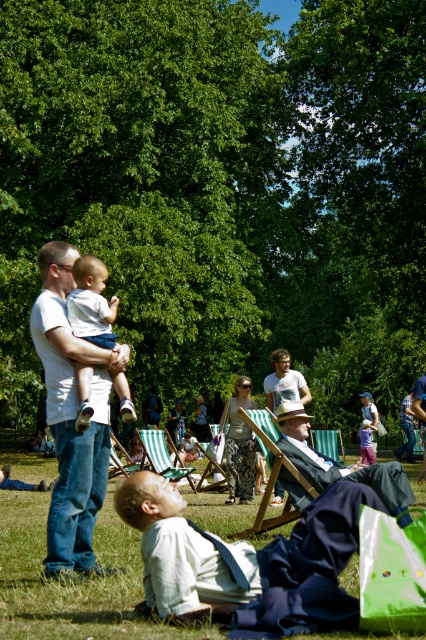
Is white t-shirt at left positioned before light brown leather chair at center?

Yes, white t-shirt at left is closer to the viewer.

Who is taller, white t-shirt at left or light brown leather chair at center?

With more height is white t-shirt at left.

Is point (57, 388) closer to camera compared to point (307, 474)?

Yes, it is.

Identify the location of white t-shirt at left. (71, 417).

From the picture: Which of these two, green grass at lower center or green striped beach chair at center, stands shorter?

green striped beach chair at center

Is point (414, 516) behind point (138, 433)?

No, it is not.

Is point (31, 616) less distant than point (157, 451)?

Yes, point (31, 616) is in front of point (157, 451).

This screenshot has height=640, width=426. Identify the location of green grass at lower center. (75, 584).

Is matte white baby at center closer to the viewer compared to light brown hair at center?

Yes, it is in front of light brown hair at center.

Between matte white baby at center and light brown hair at center, which one appears on the right side from the viewer's perspective?

light brown hair at center is more to the right.

The height and width of the screenshot is (640, 426). What are the coordinates of `matte white baby at center` in the screenshot? It's located at (71, 417).